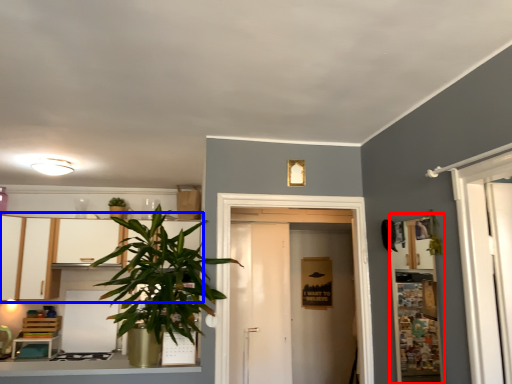
Question: Among these objects, which one is farthest to the camera, shelf (highlighted by a red box) or dresser (highlighted by a blue box)?

Choices:
 (A) shelf
 (B) dresser

Answer: (B)